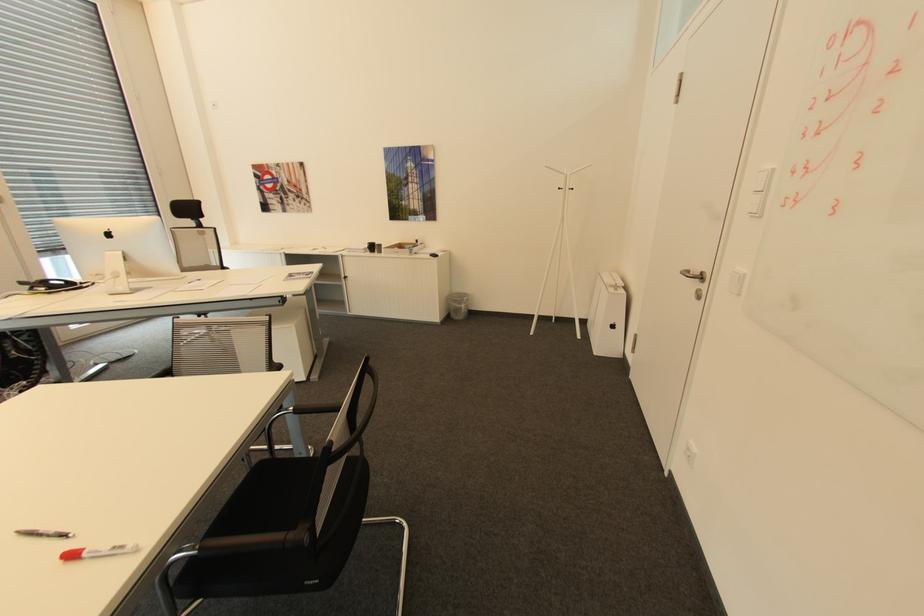
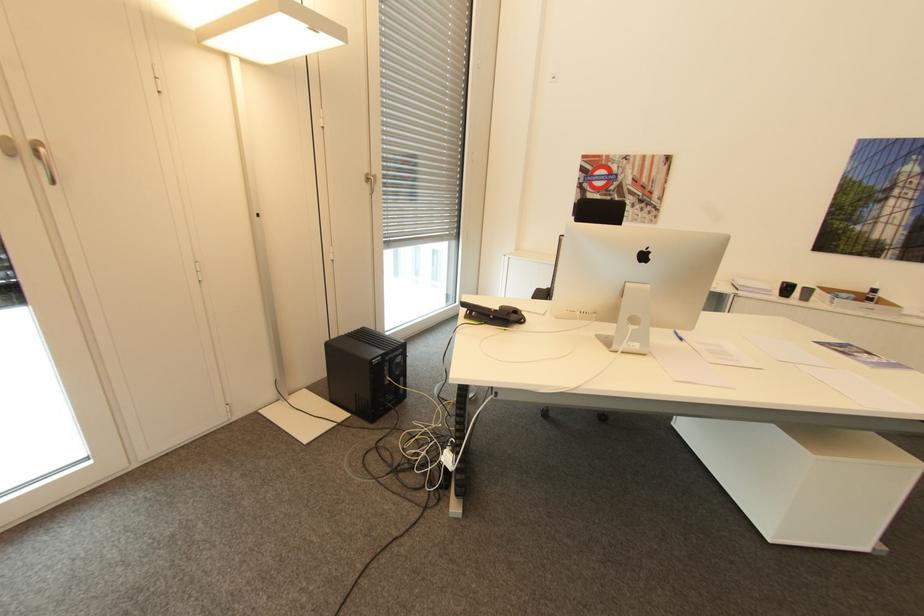
Question: What movement of the cameraman would produce the second image?

Choices:
 (A) Left
 (B) Right
 (C) Forward
 (D) Backward

Answer: (A)